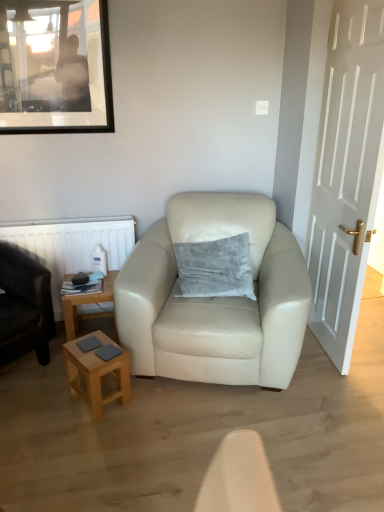
Question: Which direction should I rotate to look at matte cream leather armchair at center, positioned as the 1th chair in right-to-left order, — up or down?

Choices:
 (A) up
 (B) down

Answer: (B)

Question: From the image's perspective, is matte black armchair at left, the 1th chair viewed from the left, on top of white plastic radiator at left?

Choices:
 (A) yes
 (B) no

Answer: (B)

Question: Is matte black armchair at left, arranged as the 2th chair when viewed from the right, not close to white plastic radiator at left?

Choices:
 (A) no
 (B) yes

Answer: (A)

Question: Can you confirm if matte black armchair at left, the 1th chair viewed from the left, is shorter than white plastic radiator at left?

Choices:
 (A) no
 (B) yes

Answer: (A)

Question: From the image's perspective, would you say matte black armchair at left, the 1th chair viewed from the left, is shown under white plastic radiator at left?

Choices:
 (A) no
 (B) yes

Answer: (B)

Question: Is matte black armchair at left, arranged as the 2th chair when viewed from the right, outside of white plastic radiator at left?

Choices:
 (A) yes
 (B) no

Answer: (A)

Question: Does matte black armchair at left, the 1th chair viewed from the left, touch white plastic radiator at left?

Choices:
 (A) no
 (B) yes

Answer: (A)

Question: Can you confirm if white plastic radiator at left is taller than gray velvety pillow at center?

Choices:
 (A) no
 (B) yes

Answer: (B)

Question: Could you tell me if white plastic radiator at left is facing gray velvety pillow at center?

Choices:
 (A) no
 (B) yes

Answer: (A)

Question: Is white plastic radiator at left smaller than gray velvety pillow at center?

Choices:
 (A) no
 (B) yes

Answer: (B)

Question: Does white plastic radiator at left lie behind gray velvety pillow at center?

Choices:
 (A) yes
 (B) no

Answer: (A)

Question: Is white plastic radiator at left far from gray velvety pillow at center?

Choices:
 (A) yes
 (B) no

Answer: (B)

Question: Can you confirm if white plastic radiator at left is thinner than gray velvety pillow at center?

Choices:
 (A) no
 (B) yes

Answer: (B)

Question: From the image's perspective, is matte black picture frame at upper left under light brown wooden stool at lower left?

Choices:
 (A) no
 (B) yes

Answer: (A)